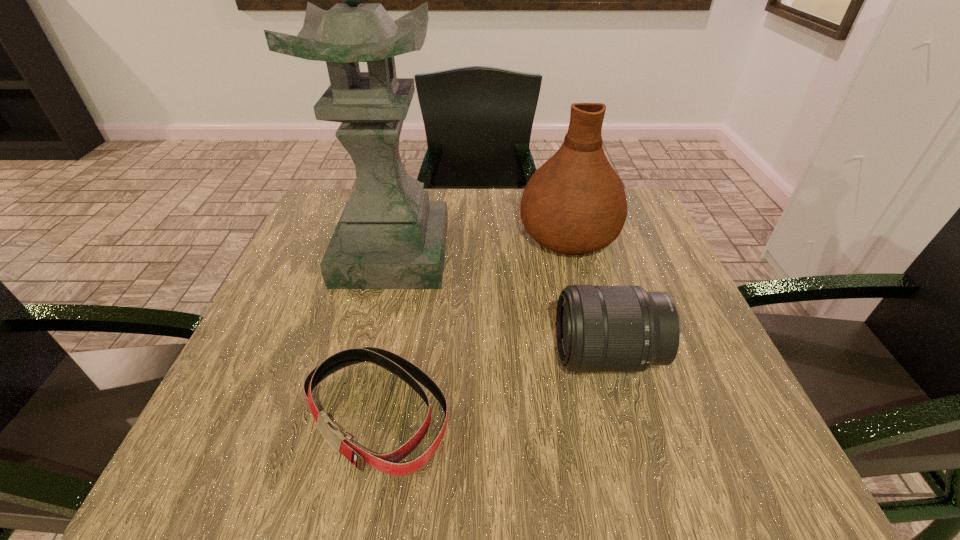
The image size is (960, 540). I want to click on the tallest object, so click(390, 236).

Locate an element on the screen. The image size is (960, 540). pitcher is located at coordinates (575, 203).

Locate an element on the screen. telephoto lens is located at coordinates (598, 328).

Identify the location of the shortest object. (387, 463).

This screenshot has height=540, width=960. In order to click on vacant space situated at the front opening of the tallest object in this screenshot , I will do `click(371, 347)`.

Where is `free spot located on the side of the second tallest object with the handle`? The height and width of the screenshot is (540, 960). free spot located on the side of the second tallest object with the handle is located at coordinates (557, 191).

Find the location of a particular element. Image resolution: width=960 pixels, height=540 pixels. vacant area situated on the side of the second tallest object with the handle is located at coordinates (556, 189).

This screenshot has height=540, width=960. What are the coordinates of `vacant space located on the surface of the telephoto lens` in the screenshot? It's located at (430, 356).

Locate an element on the screen. free region located 0.360m on the surface of the telephoto lens is located at coordinates point(349,356).

At what (x,y) coordinates should I click in order to perform the action: click on vacant space positioned on the surface of the telephoto lens. Please return your answer as a coordinate pair (x, y). Looking at the image, I should click on (349, 356).